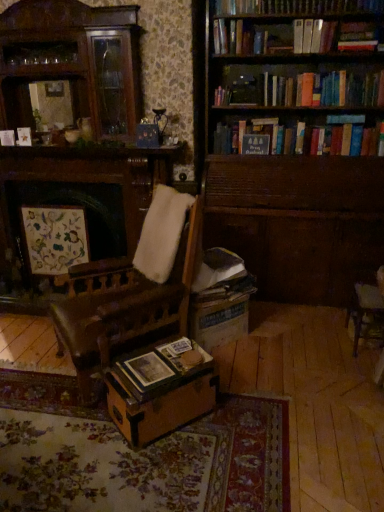
Question: From the image's perspective, is hardcover book at upper right, the third book positioned from the left, above or below hardcover book at upper center, which is the 1th book in back-to-front order?

Choices:
 (A) above
 (B) below

Answer: (A)

Question: In the image, is hardcover book at upper right, marked as the 1th book in a top-to-bottom arrangement, positioned in front of or behind hardcover book at upper center, which is the 1th book in back-to-front order?

Choices:
 (A) behind
 (B) front

Answer: (B)

Question: Estimate the real-world distances between objects in this image. Which object is farther from the wooden trunk at center?

Choices:
 (A) matte paper at center
 (B) hardcover book at upper right, marked as the 1th book in a top-to-bottom arrangement
 (C) wooden chair at right
 (D) hardcover book at upper center, positioned as the second book in left-to-right order
 (E) wooden photo album at center, the 1th book in the bottom-to-top sequence

Answer: (B)

Question: Which object is the farthest from the wooden bookshelf at upper right?

Choices:
 (A) hardcover book at upper right, the third book positioned from the left
 (B) matte paper at center
 (C) matte floral artwork at left
 (D) hardcover book at upper center, which appears as the third book when viewed from the front
 (E) wooden chair at right

Answer: (B)